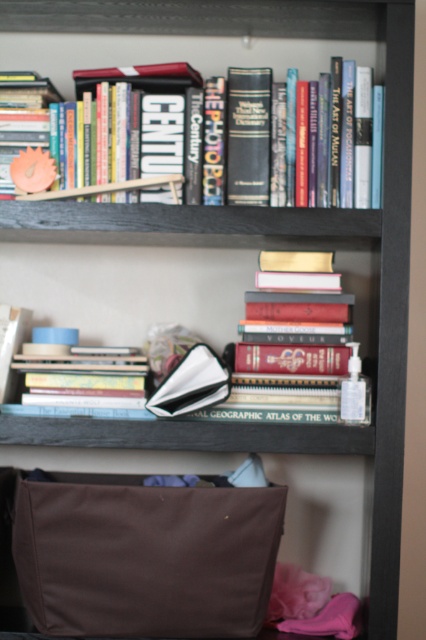
You are organizing books on a bookshelf. You have two books to place next to each other. The first is labeled as hardcover books at center and the second is labeled as hardcover book at upper center. Which book should you place on the bottom shelf if you want the taller book to be on top?

You should place the hardcover book at upper center on the top shelf since it is taller than the hardcover books at center.

You are organizing a bookshelf and need to place a new book between the hardcover books at center and the hardcover book at upper center. Is there enough space between them for the new book?

The hardcover books at center is positioned under the hardcover book at upper center, so there is vertical space between them. However, since the question mentions placing the new book between them, it depends on the horizontal or vertical orientation. If placing vertically between, there might be space, but if horizontally, they are aligned vertically. Clarify the direction needed.